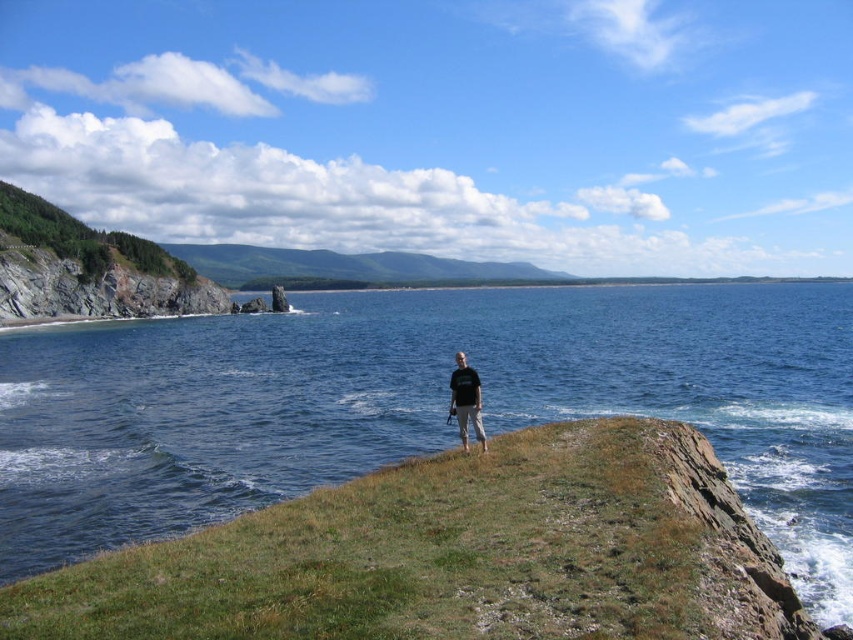
You are standing on the rocky outcrop in the foreground of the coastal scene. You want to walk to the blue water at center. Which direction should you head to reach it?

You should head toward the center of the image to reach the blue water at center, as it is located at coordinates point (421, 404).

You are a photographer standing at the rocky outcrop in the coastal scene. You want to capture a wide shot that includes both the blue water at center and the black cotton shirt at center. Which object will occupy more of the frame?

The blue water at center is larger in size than the black cotton shirt at center, so it will occupy more of the frame in the photograph.